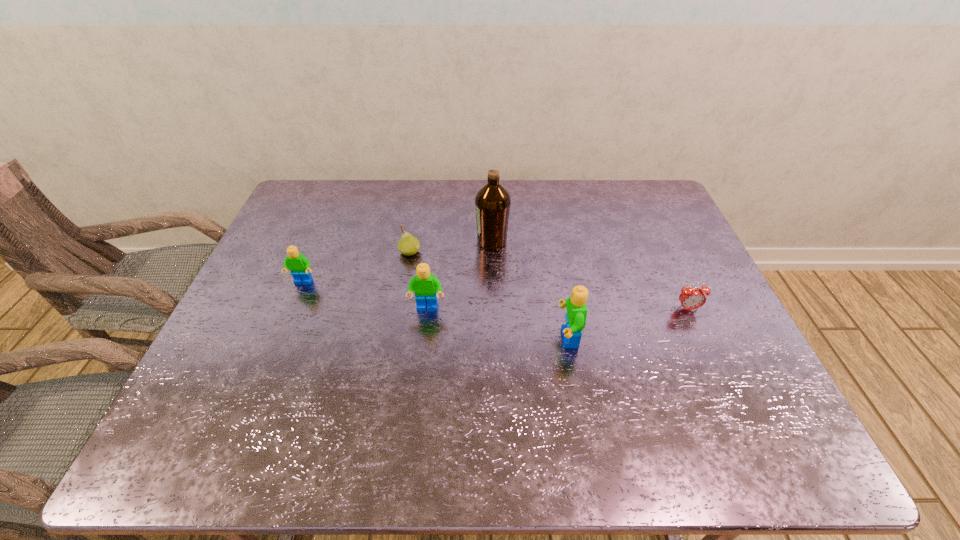
You are a GUI agent. You are given a task and a screenshot of the screen. Output one action in this format:
    pyautogui.click(x=<x>, y=<y>)
    Task: Click on the vacant place for an extra Lego on the right
    This screenshot has width=960, height=540.
    Given the screenshot: What is the action you would take?
    pyautogui.click(x=727, y=372)